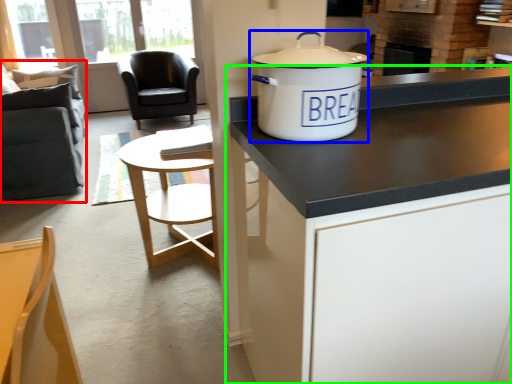
Question: Considering the real-world distances, which object is closest to swivel chair (highlighted by a red box)? cooker (highlighted by a blue box) or cabinetry (highlighted by a green box).

Choices:
 (A) cooker
 (B) cabinetry

Answer: (A)